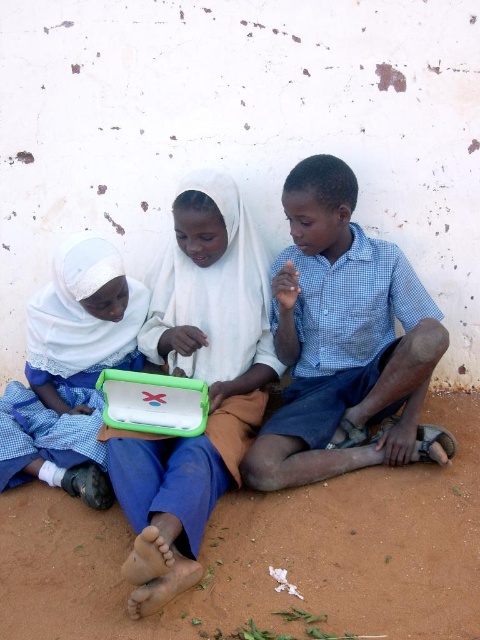
You are a photographer trying to capture a clear photo of the matte green plastic tablet at center. The blue checkered shirt at center is blocking your view. Can you move the shirt to get a better shot?

The blue checkered shirt at center is in front of the matte green plastic tablet at center, so moving the shirt would allow you to see the tablet clearly.

You are a photographer trying to capture a closeup of the blue checkered shirt at center and the green plastic tablet at center in the scene. Given that your camera can only focus on objects within a 10 inch range, will both items be in focus?

The blue checkered shirt at center is 10.35 inches away from the green plastic tablet at center. Since the distance between them exceeds the camera focus range of 10 inches, they cannot both be in focus simultaneously.